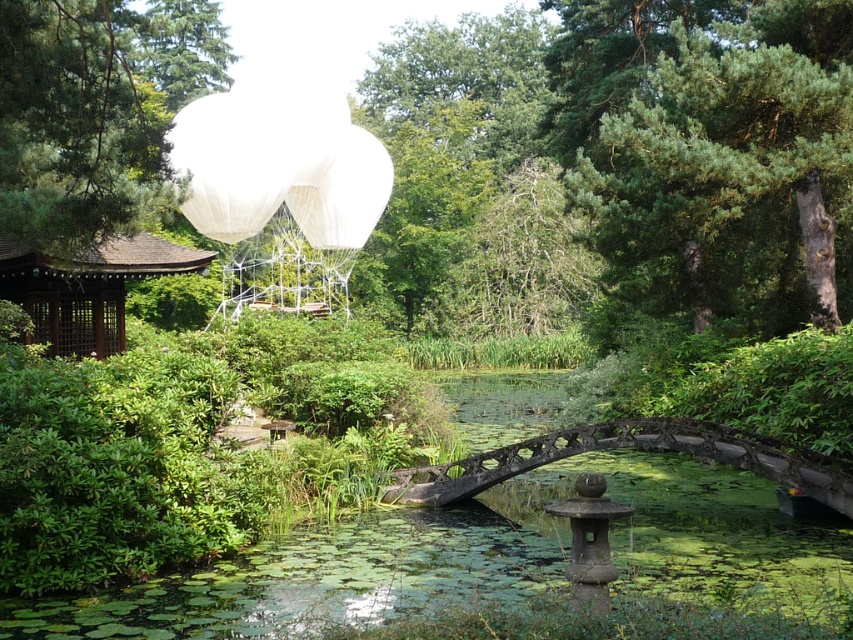
Question: Considering the real-world distances, which object is farthest from the green pine tree at upper left?

Choices:
 (A) brown wooden gazebo at left
 (B) green textured tree at upper right
 (C) white mesh balloon at upper center
 (D) rusty metal bridge at center

Answer: (B)

Question: Which of the following is the farthest from the observer?

Choices:
 (A) (570, 429)
 (B) (340, 205)

Answer: (B)

Question: Is green textured tree at upper right further to the viewer compared to rusty metal bridge at center?

Choices:
 (A) yes
 (B) no

Answer: (A)

Question: Which object is closer to the camera taking this photo?

Choices:
 (A) brown wooden gazebo at left
 (B) green pine tree at upper left

Answer: (B)

Question: Is brown wooden gazebo at left positioned in front of white mesh balloon at upper center?

Choices:
 (A) no
 (B) yes

Answer: (B)

Question: Is rusty metal bridge at center further to the viewer compared to white mesh balloon at upper center?

Choices:
 (A) no
 (B) yes

Answer: (A)